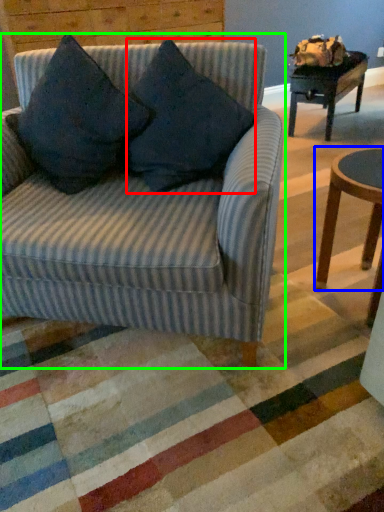
Question: Considering the real-world distances, which object is closest to throw pillow (highlighted by a red box)? coffee table (highlighted by a blue box) or studio couch (highlighted by a green box).

Choices:
 (A) coffee table
 (B) studio couch

Answer: (B)